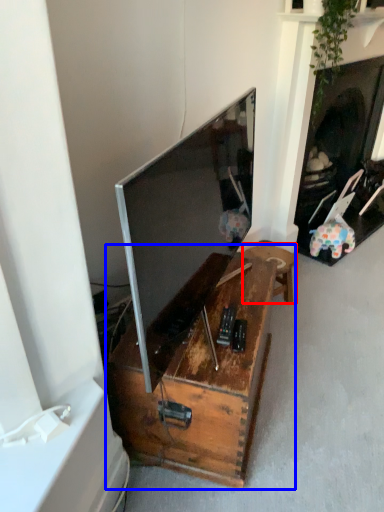
Question: Which point is closer to the camera, furniture (highlighted by a red box) or table (highlighted by a blue box)?

Choices:
 (A) furniture
 (B) table

Answer: (B)